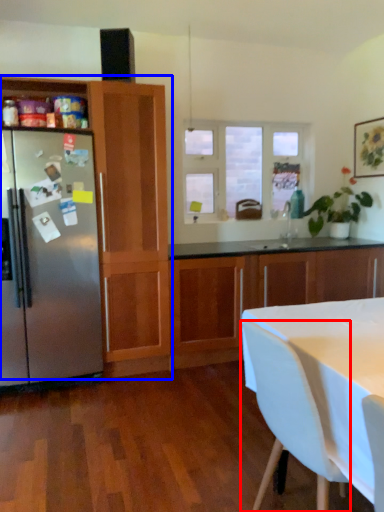
Question: Among these objects, which one is farthest to the camera, chair (highlighted by a red box) or cabinetry (highlighted by a blue box)?

Choices:
 (A) chair
 (B) cabinetry

Answer: (B)